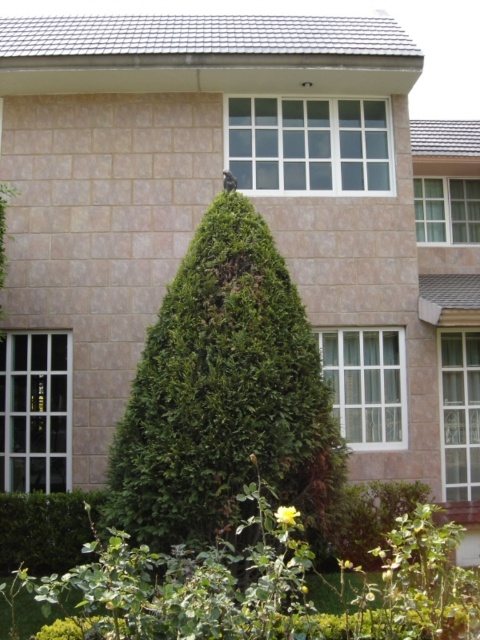
You are a landscape architect designing a garden for this building. You need to place a new statue that requires a space larger than the white textured glass at right. Can the green leafy hedge at lower left accommodate the statue?

The green leafy hedge at lower left is larger in size than the white textured glass at right, so yes, the statue can be placed there as it has sufficient space.

You are a gardener planning to trim the green leafy hedge at lower left and the white textured glass at right. Which object requires more horizontal space to maintain its current shape?

The green leafy hedge at lower left might be wider than white textured glass at right, so it requires more horizontal space to maintain its current shape.

You are a delivery person trying to determine the best side of the building to approach for the entrance. You notice the clear glass window at left. Based on its position, which side of the building should you approach?

The clear glass window at left is located at point [35,412], which is on the left side of the building. Therefore, you should approach the left side of the building to find the entrance.